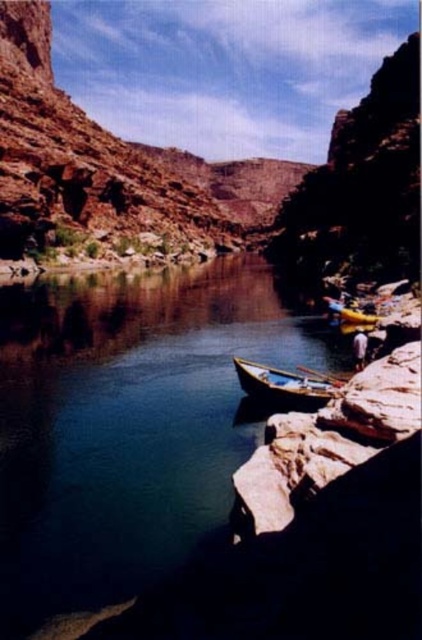
You are a photographer standing on the riverbank and want to take a photo of the wooden boat at center and the wooden paddle at lower center. Which object should you focus on first if you want to capture both in the same frame without moving the camera?

The wooden boat at center is below the wooden paddle at lower center, so you should focus on the wooden paddle at lower center first as it is closer to the camera, ensuring both objects are in focus without moving the camera.